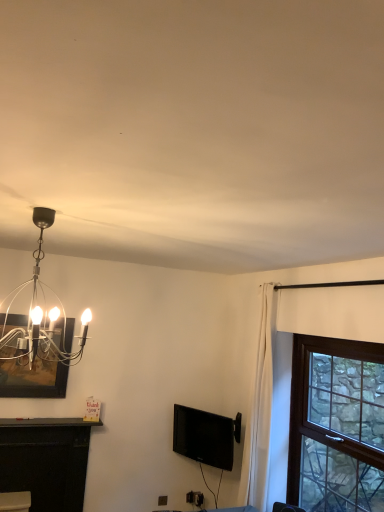
Question: Is black glossy tv at center behind brown wooden window at right?

Choices:
 (A) no
 (B) yes

Answer: (B)

Question: Is black glossy tv at center touching brown wooden window at right?

Choices:
 (A) yes
 (B) no

Answer: (B)

Question: From the image's perspective, does black glossy tv at center appear higher than brown wooden window at right?

Choices:
 (A) yes
 (B) no

Answer: (B)

Question: Would you say black glossy tv at center is outside brown wooden window at right?

Choices:
 (A) no
 (B) yes

Answer: (B)

Question: Is the depth of black glossy tv at center less than that of brown wooden window at right?

Choices:
 (A) yes
 (B) no

Answer: (B)

Question: From a real-world perspective, is black matte fireplace at lower left physically located above or below matte black picture frame at upper left?

Choices:
 (A) above
 (B) below

Answer: (B)

Question: Is black matte fireplace at lower left wider or thinner than matte black picture frame at upper left?

Choices:
 (A) wide
 (B) thin

Answer: (A)

Question: Considering the positions of point (3, 473) and point (61, 377), is point (3, 473) closer or farther from the camera than point (61, 377)?

Choices:
 (A) closer
 (B) farther

Answer: (A)

Question: Is black matte fireplace at lower left in front of or behind matte black picture frame at upper left in the image?

Choices:
 (A) front
 (B) behind

Answer: (A)

Question: Looking at the image, does matte black picture frame at upper left seem bigger or smaller compared to polished silver chandelier at upper left?

Choices:
 (A) big
 (B) small

Answer: (B)

Question: From a real-world perspective, relative to polished silver chandelier at upper left, is matte black picture frame at upper left vertically above or below?

Choices:
 (A) below
 (B) above

Answer: (A)

Question: Looking at their shapes, would you say matte black picture frame at upper left is wider or thinner than polished silver chandelier at upper left?

Choices:
 (A) wide
 (B) thin

Answer: (B)

Question: Relative to polished silver chandelier at upper left, is matte black picture frame at upper left in front or behind?

Choices:
 (A) behind
 (B) front

Answer: (A)

Question: Is brown wooden window at right situated inside polished silver chandelier at upper left or outside?

Choices:
 (A) inside
 (B) outside

Answer: (B)

Question: Visually, is brown wooden window at right positioned to the left or to the right of polished silver chandelier at upper left?

Choices:
 (A) left
 (B) right

Answer: (B)